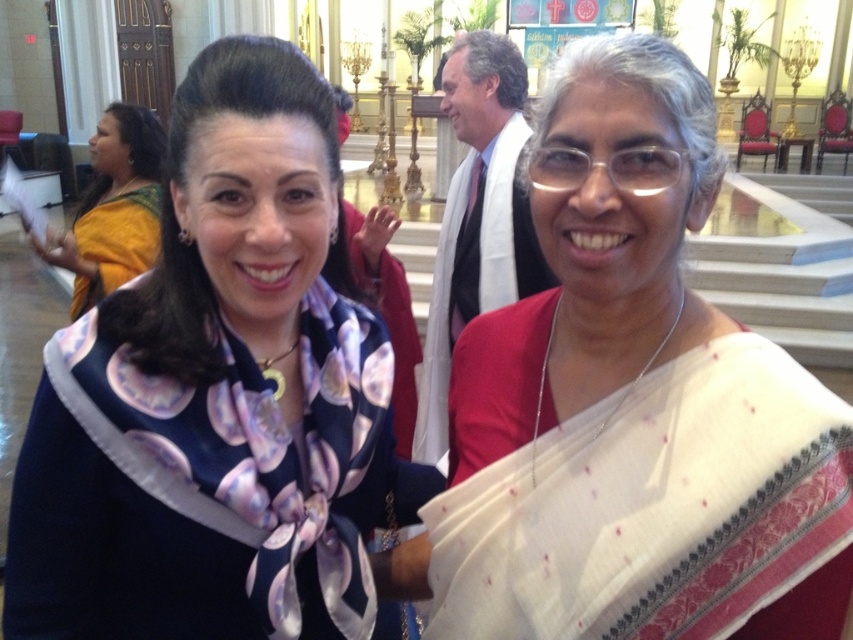
You are standing at the origin point in the image and want to move towards the two points labeled point (357, 474) and point (633, 595). Which point is closer to you?

Point (633, 595) is closer to you since it is in front of point (357, 474).

You are a photographer adjusting your camera settings to focus on the silky floral scarf at center and the white silk saree at center. Which of these two items should you focus on first to ensure clarity?

The silky floral scarf at center is closer to the viewer than the white silk saree at center, so you should focus on the silky floral scarf at center first to ensure clarity.